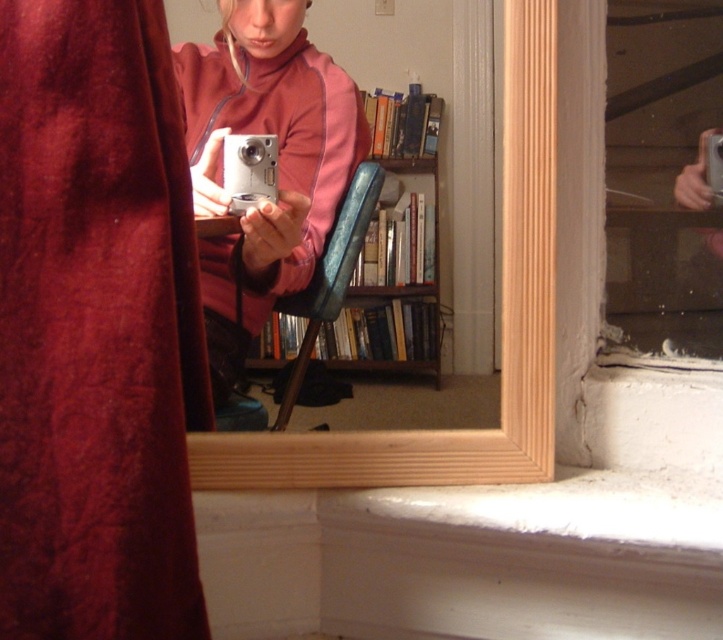
Question: Which point is farther to the camera?

Choices:
 (A) (436, 99)
 (B) (30, 464)
 (C) (659, 76)

Answer: (A)

Question: Based on their relative distances, which object is nearer to the pink fabric at center?

Choices:
 (A) velvet-like burgundy curtain at left
 (B) wooden bookshelf at center
 (C) silver metallic camera at upper right

Answer: (B)

Question: Can you confirm if silver metallic camera at upper right is positioned above wooden bookshelf at center?

Choices:
 (A) no
 (B) yes

Answer: (B)

Question: Observing the image, what is the correct spatial positioning of pink fabric at center in reference to silver metallic camera at upper right?

Choices:
 (A) above
 (B) below

Answer: (A)

Question: Based on their relative distances, which object is nearer to the pink fabric at center?

Choices:
 (A) silver metallic camera at upper right
 (B) wooden bookshelf at center

Answer: (B)

Question: Is silver metallic camera at upper right to the left of wooden bookshelf at center from the viewer's perspective?

Choices:
 (A) yes
 (B) no

Answer: (B)